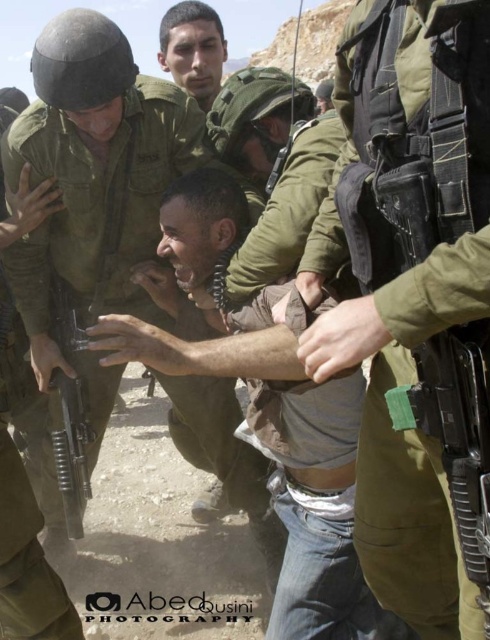
Looking at this image, who is lower down, green fabric uniform at center or green matte uniform at center?

green fabric uniform at center

Is green fabric uniform at center closer to camera compared to green matte uniform at center?

Yes, it is in front of green matte uniform at center.

Find the location of `green fabric uniform at center`. green fabric uniform at center is located at coordinates (430, 240).

Does green matte uniform at center appear under matte black rifle at center?

Incorrect, green matte uniform at center is not positioned below matte black rifle at center.

Find the location of a particular element. Image resolution: width=490 pixels, height=640 pixels. green matte uniform at center is located at coordinates (98, 198).

Where is `green matte uniform at center`? This screenshot has height=640, width=490. green matte uniform at center is located at coordinates (98, 198).

Find the location of `green matte uniform at center`. green matte uniform at center is located at coordinates (98, 198).

Is green fabric uniform at center shorter than matte black rifle at center?

No, green fabric uniform at center is not shorter than matte black rifle at center.

Can you confirm if green fabric uniform at center is positioned to the right of matte black rifle at center?

Yes, green fabric uniform at center is to the right of matte black rifle at center.

Measure the distance between green fabric uniform at center and camera.

A distance of 2.09 meters exists between green fabric uniform at center and camera.

Locate an element on the screen. The width and height of the screenshot is (490, 640). green fabric uniform at center is located at coordinates (430, 240).